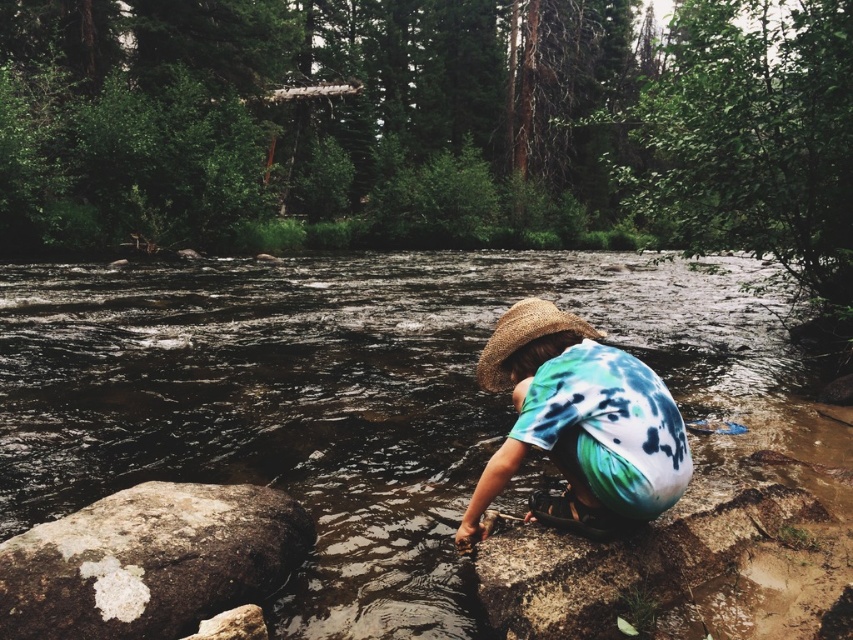
How distant is tie-dye fabric shirt at center from strawmaterial/texturehat at lower center?

tie-dye fabric shirt at center and strawmaterial/texturehat at lower center are 29.32 centimeters apart from each other.

What do you see at coordinates (579, 422) in the screenshot? I see `tie-dye fabric shirt at center` at bounding box center [579, 422].

Where is `tie-dye fabric shirt at center`? tie-dye fabric shirt at center is located at coordinates (579, 422).

Is brown rocky river at center positioned in front of tie-dye fabric shirt at center?

Yes, brown rocky river at center is closer to the viewer.

Can you confirm if brown rocky river at center is positioned below tie-dye fabric shirt at center?

No, brown rocky river at center is not below tie-dye fabric shirt at center.

Is point (485, 456) closer to viewer compared to point (595, 429)?

No, it is behind (595, 429).

You are a GUI agent. You are given a task and a screenshot of the screen. Output one action in this format:
    pyautogui.click(x=<x>, y=<y>)
    Task: Click on the brown rocky river at center
    
    Given the screenshot: What is the action you would take?
    pyautogui.click(x=363, y=397)

Who is taller, brown rocky river at center or speckled brown rock at lower left?

Standing taller between the two is brown rocky river at center.

Which is more to the right, brown rocky river at center or speckled brown rock at lower left?

Positioned to the right is speckled brown rock at lower left.

Is point (730, 458) positioned before point (20, 625)?

No, it is not.

The width and height of the screenshot is (853, 640). Find the location of `brown rocky river at center`. brown rocky river at center is located at coordinates (363, 397).